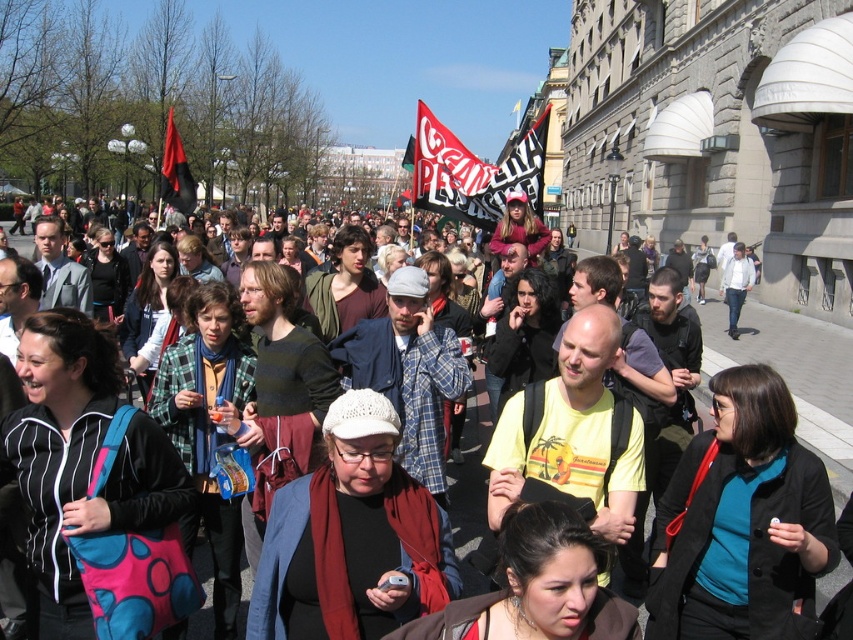
Question: Can you confirm if matte black backpack at center is positioned below black fabric flag at upper left?

Choices:
 (A) no
 (B) yes

Answer: (B)

Question: Does red and white fabric flag at center appear on the left side of black fabric flag at upper left?

Choices:
 (A) yes
 (B) no

Answer: (B)

Question: Considering the relative positions of matte black backpack at center and black fabric flag at upper left in the image provided, where is matte black backpack at center located with respect to black fabric flag at upper left?

Choices:
 (A) above
 (B) below

Answer: (B)

Question: Among these points, which one is nearest to the camera?

Choices:
 (A) (166, 125)
 (B) (450, 188)
 (C) (614, 586)

Answer: (C)

Question: Which object is closer to the camera taking this photo?

Choices:
 (A) black fabric flag at upper left
 (B) matte black backpack at center
 (C) red and white fabric flag at center

Answer: (B)

Question: Which object appears closest to the camera in this image?

Choices:
 (A) matte black backpack at center
 (B) red and white fabric flag at center
 (C) black fabric flag at upper left

Answer: (A)